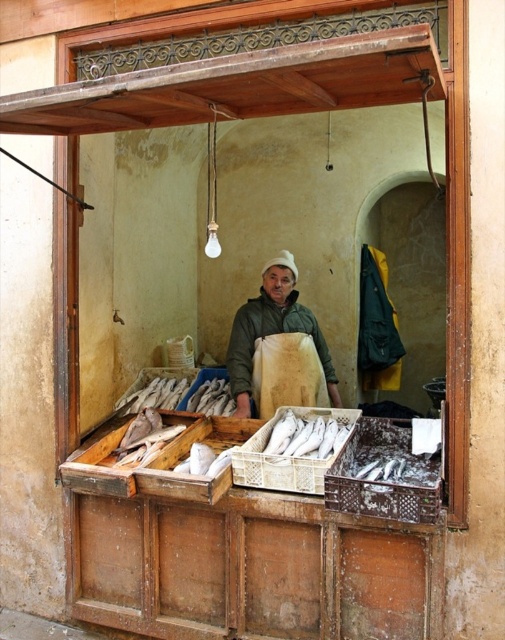
You are a customer at the fish vendor stall. You see a green matte jacket at center and a white plastic fish at center. Which object is placed above the other?

The green matte jacket at center is positioned over the white plastic fish at center.

You are a customer at the fish vendor stall. You see the green matte jacket at center and the white plastic fish at center. Which item is bigger in size?

The green matte jacket at center has a larger size compared to the white plastic fish at center, so the green matte jacket at center is bigger.